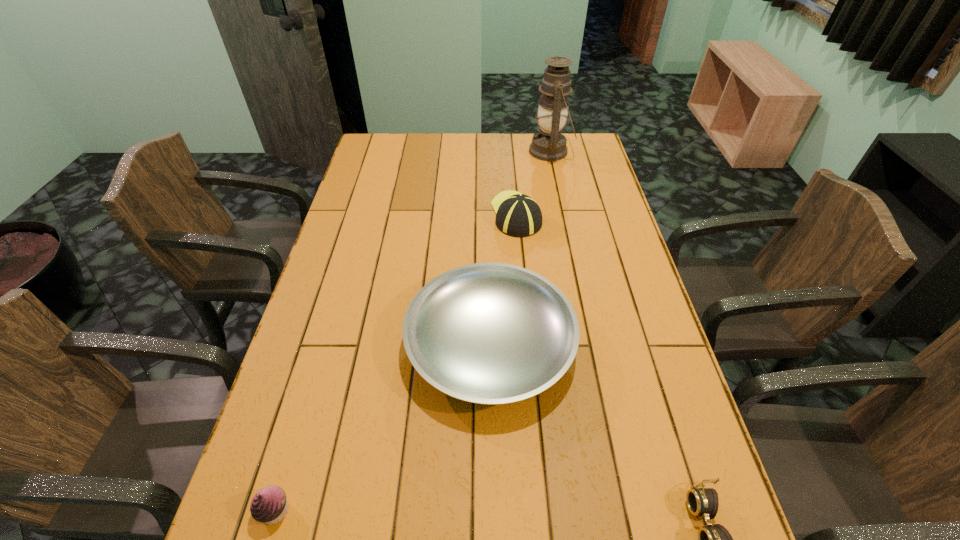
The image size is (960, 540). What are the coordinates of `the tallest object` in the screenshot? It's located at (549, 144).

The height and width of the screenshot is (540, 960). What are the coordinates of `the farthest object` in the screenshot? It's located at (549, 144).

Locate an element on the screen. the second farthest object is located at coordinates (517, 214).

Image resolution: width=960 pixels, height=540 pixels. What are the coordinates of `cupcake` in the screenshot? It's located at (269, 505).

Locate an element on the screen. the third farthest object is located at coordinates (488, 333).

The height and width of the screenshot is (540, 960). Identify the location of vacant space located 0.080m on the front of the oil lamp. (557, 179).

Find the location of a particular element. The height and width of the screenshot is (540, 960). free spot located with the brim of the baseball cap facing forward is located at coordinates (513, 171).

At what (x,y) coordinates should I click in order to perform the action: click on blank area located with the brim of the baseball cap facing forward. Please return your answer as a coordinate pair (x, y). This screenshot has width=960, height=540. Looking at the image, I should click on tap(511, 151).

Image resolution: width=960 pixels, height=540 pixels. In order to click on vacant position located 0.310m with the brim of the baseball cap facing forward in this screenshot , I will do `click(510, 150)`.

Where is `free space located on the back of the leftmost object`? The height and width of the screenshot is (540, 960). free space located on the back of the leftmost object is located at coordinates (312, 385).